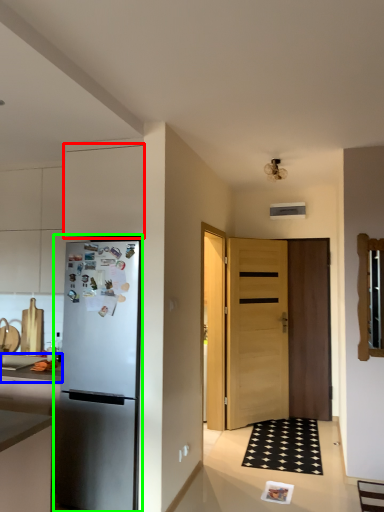
Question: Which object is the closest to the cabinetry (highlighted by a red box)? Choose among these: countertop (highlighted by a blue box) or refrigerator (highlighted by a green box).

Choices:
 (A) countertop
 (B) refrigerator

Answer: (B)